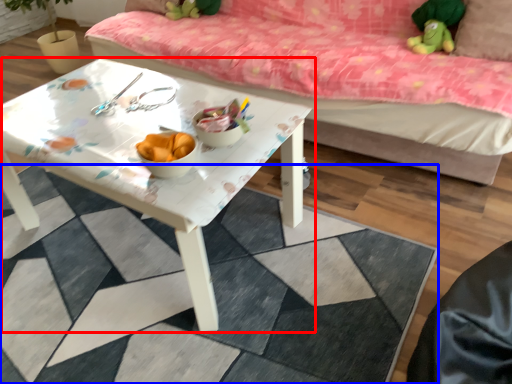
Question: Which object appears closest to the camera in this image, table (highlighted by a red box) or tile (highlighted by a blue box)?

Choices:
 (A) table
 (B) tile

Answer: (B)